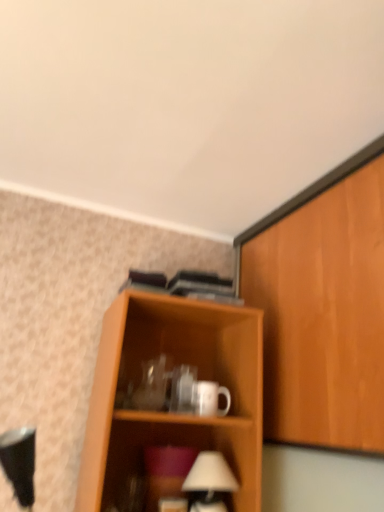
Question: Are wooden cabinet at right and white matte table lamp at lower center far apart?

Choices:
 (A) yes
 (B) no

Answer: (B)

Question: Is wooden cabinet at right taller than white matte table lamp at lower center?

Choices:
 (A) no
 (B) yes

Answer: (B)

Question: Does wooden cabinet at right lie behind white matte table lamp at lower center?

Choices:
 (A) no
 (B) yes

Answer: (A)

Question: Is wooden cabinet at right facing away from white matte table lamp at lower center?

Choices:
 (A) no
 (B) yes

Answer: (A)

Question: Does wooden cabinet at right have a lesser height compared to white matte table lamp at lower center?

Choices:
 (A) no
 (B) yes

Answer: (A)

Question: Is wooden cabinet at right closer to the viewer compared to white matte table lamp at lower center?

Choices:
 (A) no
 (B) yes

Answer: (B)

Question: From a real-world perspective, is wooden cabinet at right physically above white glossy mug at center?

Choices:
 (A) no
 (B) yes

Answer: (B)

Question: From the image's perspective, would you say wooden cabinet at right is positioned over white glossy mug at center?

Choices:
 (A) yes
 (B) no

Answer: (A)

Question: Is wooden cabinet at right positioned before white glossy mug at center?

Choices:
 (A) no
 (B) yes

Answer: (B)

Question: Does wooden cabinet at right have a larger size compared to white glossy mug at center?

Choices:
 (A) no
 (B) yes

Answer: (B)

Question: Does wooden cabinet at right appear on the left side of white glossy mug at center?

Choices:
 (A) no
 (B) yes

Answer: (A)

Question: Considering the relative sizes of wooden cabinet at right and white glossy mug at center in the image provided, is wooden cabinet at right wider than white glossy mug at center?

Choices:
 (A) yes
 (B) no

Answer: (A)

Question: Can you confirm if white glossy mug at center is smaller than wooden cabinet at right?

Choices:
 (A) no
 (B) yes

Answer: (B)